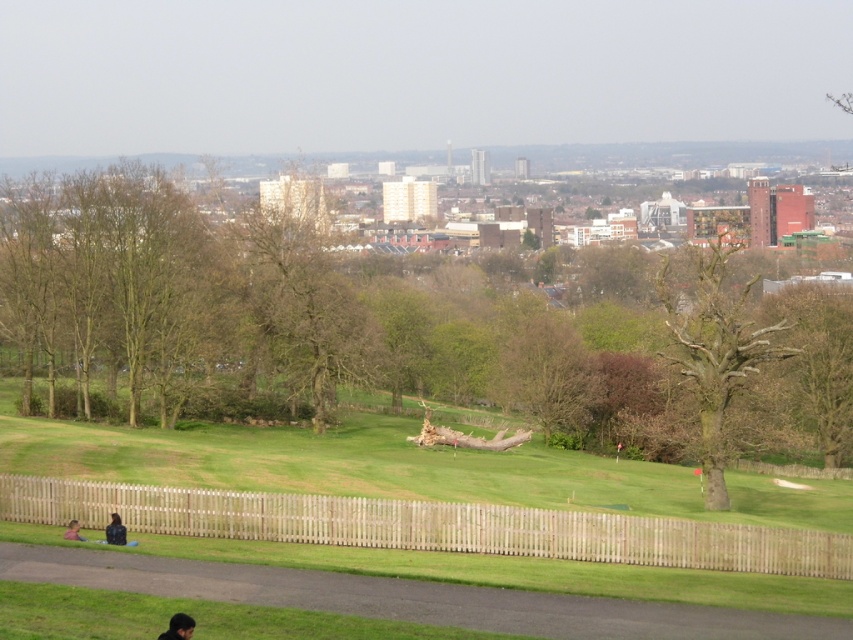
You are standing at the entrance of the park and want to take a photo of the dark blue shirt at lower left and the brown rough textured tree at right. Can you see both objects clearly in the same frame without moving your camera?

The dark blue shirt at lower left is behind the brown rough textured tree at right, so the tree may block the view of the shirt in the photo. You might need to adjust your position to ensure both are visible.

You are planning to set up a picnic blanket in the park. The green grass at center and the brown rough textured tree at right are both visible from your current position. Which area would you choose to place your picnic blanket, and why?

You should place the picnic blanket on the green grass at center because it is bigger than the brown rough textured tree at right, providing more space for the blanket.

You are planning to set up a picnic blanket in the park. The picnic blanket is 2 meters wide. You see the green grass at center and the brown rough textured tree at right. Which area would be suitable for placing the blanket without overlapping the tree?

The green grass at center is wider than the brown rough textured tree at right, so placing the picnic blanket on the green grass at center would be suitable as it has enough space to accommodate the 2 meter width without overlapping the tree.